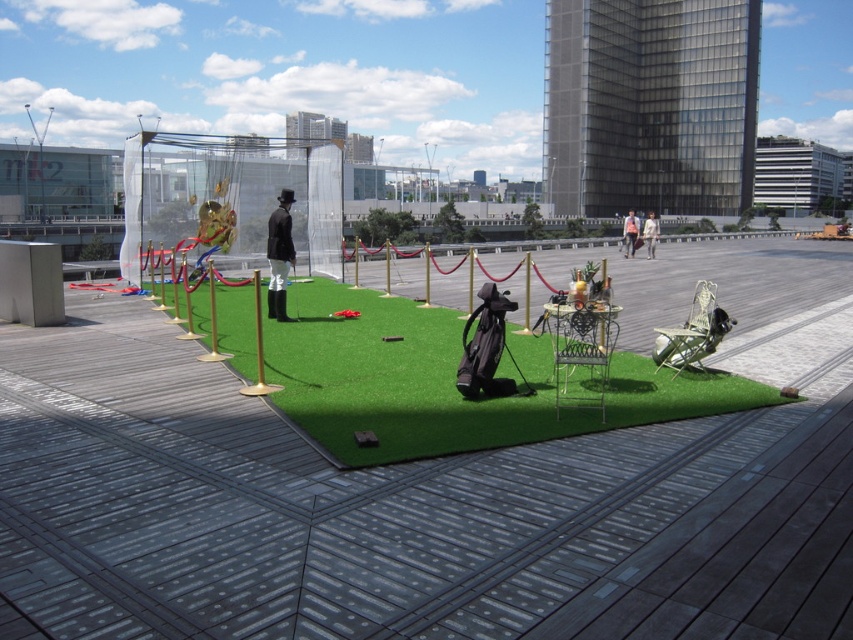
Does point (630, 244) come closer to viewer compared to point (651, 214)?

Yes.

Can you confirm if pink fabric at center is smaller than light beige fabric coat at center?

Correct, pink fabric at center occupies less space than light beige fabric coat at center.

What are the coordinates of `pink fabric at center` in the screenshot? It's located at (630, 234).

Can you confirm if black leather jacket at center is positioned to the left of light beige fabric coat at center?

Yes, black leather jacket at center is to the left of light beige fabric coat at center.

Who is more forward, (279,244) or (653,214)?

Point (279,244) is in front.

Describe the element at coordinates (279, 256) in the screenshot. I see `black leather jacket at center` at that location.

I want to click on black leather jacket at center, so click(279, 256).

Can you confirm if metallic silver chair at center is taller than black leather jacket at center?

No.

Locate an element on the screen. Image resolution: width=853 pixels, height=640 pixels. metallic silver chair at center is located at coordinates coord(582,353).